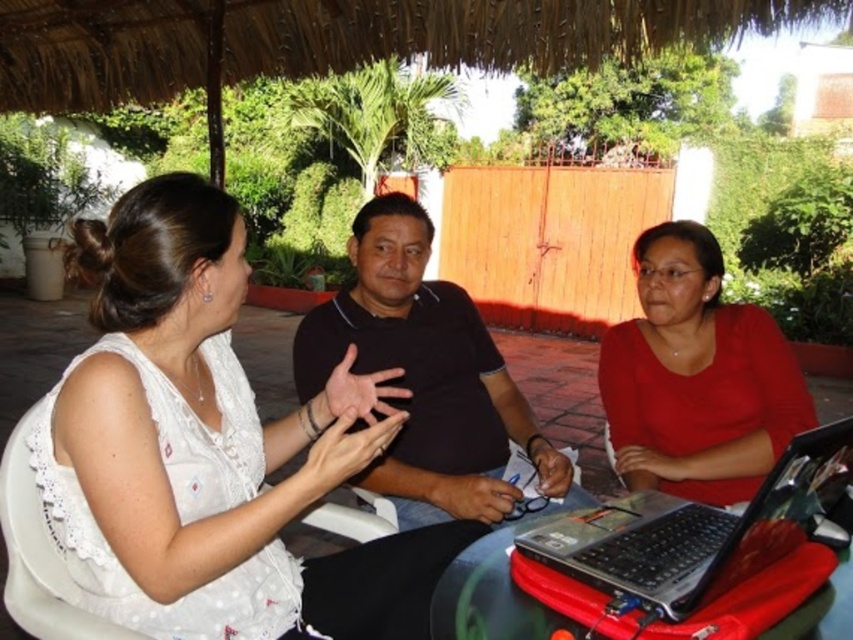
Does point (476, 442) come behind point (773, 392)?

Yes, point (476, 442) is farther from viewer.

Describe the element at coordinates (427, 378) in the screenshot. The height and width of the screenshot is (640, 853). I see `black matte shirt at center` at that location.

Which is in front, point (498, 401) or point (720, 259)?

Positioned in front is point (720, 259).

Where is `black matte shirt at center`? The image size is (853, 640). black matte shirt at center is located at coordinates (427, 378).

Between white lace blouse at upper left and silver/black plastic laptop at lower right, which one is positioned higher?

white lace blouse at upper left is higher up.

From the picture: Is white lace blouse at upper left shorter than silver/black plastic laptop at lower right?

No.

Find the location of a particular element. Image resolution: width=853 pixels, height=640 pixels. white lace blouse at upper left is located at coordinates (212, 449).

At what (x,y) coordinates should I click in order to perform the action: click on white lace blouse at upper left. Please return your answer as a coordinate pair (x, y). The width and height of the screenshot is (853, 640). Looking at the image, I should click on (212, 449).

Is silver/black plastic laptop at lower right to the left of white fabric chair at center from the viewer's perspective?

Incorrect, silver/black plastic laptop at lower right is not on the left side of white fabric chair at center.

Is point (570, 548) positioned after point (361, 538)?

No.

At what (x,y) coordinates should I click in order to perform the action: click on silver/black plastic laptop at lower right. Please return your answer as a coordinate pair (x, y). Image resolution: width=853 pixels, height=640 pixels. Looking at the image, I should click on (694, 532).